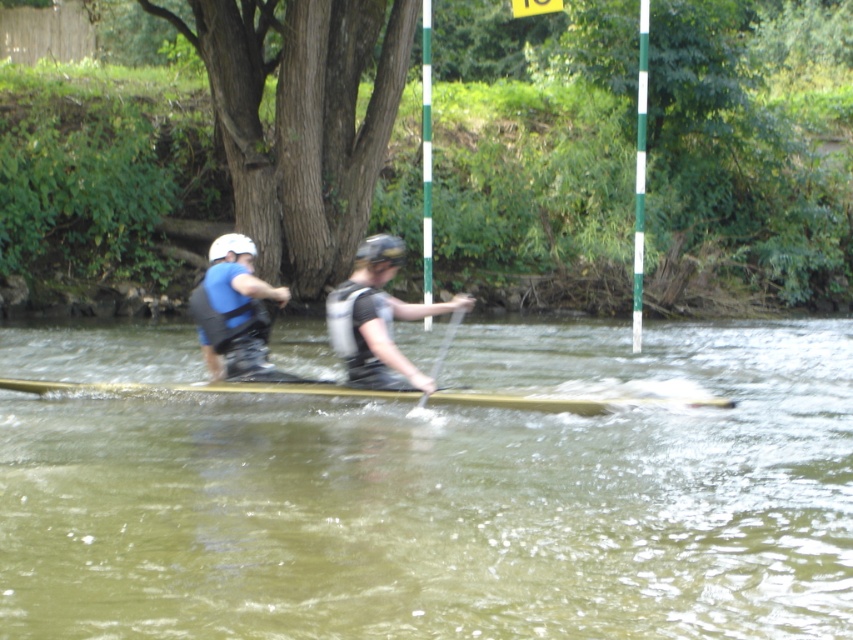
Can you confirm if greenish murky water at center is positioned to the left of matte black wetsuit at center?

Indeed, greenish murky water at center is positioned on the left side of matte black wetsuit at center.

Who is more forward, (115, 422) or (369, 368)?

Positioned in front is point (369, 368).

Who is more distant from viewer, (315, 573) or (344, 328)?

The point (344, 328) is behind.

Locate an element on the screen. The width and height of the screenshot is (853, 640). greenish murky water at center is located at coordinates (451, 499).

The width and height of the screenshot is (853, 640). I want to click on greenish murky water at center, so click(451, 499).

Which is in front, point (746, 506) or point (346, 387)?

Positioned in front is point (746, 506).

The image size is (853, 640). Find the location of `greenish murky water at center`. greenish murky water at center is located at coordinates pos(451,499).

Does blue matte life vest at left have a larger size compared to wooden canoe at center?

Indeed, blue matte life vest at left has a larger size compared to wooden canoe at center.

Who is shorter, blue matte life vest at left or wooden canoe at center?

Standing shorter between the two is wooden canoe at center.

Is point (225, 278) less distant than point (457, 392)?

Yes, point (225, 278) is in front of point (457, 392).

Find the location of a particular element. This screenshot has width=853, height=640. blue matte life vest at left is located at coordinates (235, 312).